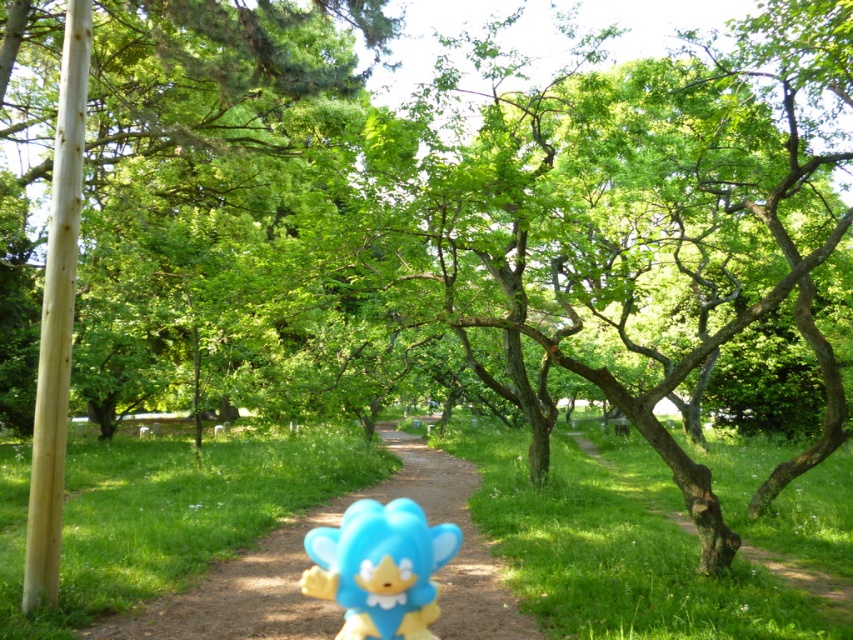
Question: Which point appears closest to the camera in this image?

Choices:
 (A) (390, 602)
 (B) (202, 4)

Answer: (A)

Question: Based on their relative distances, which object is farther from the blue plastic toy at center?

Choices:
 (A) green leafy tree at center
 (B) green grassy trail at center
 (C) blue rubber toy at center

Answer: (A)

Question: Is green leafy tree at center positioned behind blue plastic toy at center?

Choices:
 (A) no
 (B) yes

Answer: (B)

Question: Which is nearer to the green leafy tree at center?

Choices:
 (A) green grassy trail at center
 (B) blue plastic toy at center

Answer: (B)

Question: Does green leafy tree at center appear on the left side of green grassy trail at center?

Choices:
 (A) no
 (B) yes

Answer: (B)

Question: Does green leafy tree at center have a lesser width compared to blue plastic toy at center?

Choices:
 (A) yes
 (B) no

Answer: (B)